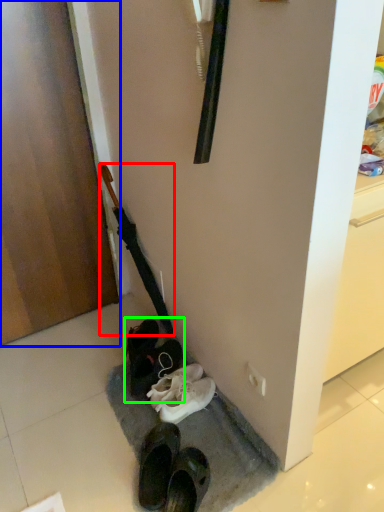
Question: Based on their relative distances, which object is nearer to umbrella (highlighted by a red box)? Choose from door (highlighted by a blue box) and footwear (highlighted by a green box).

Choices:
 (A) door
 (B) footwear

Answer: (B)